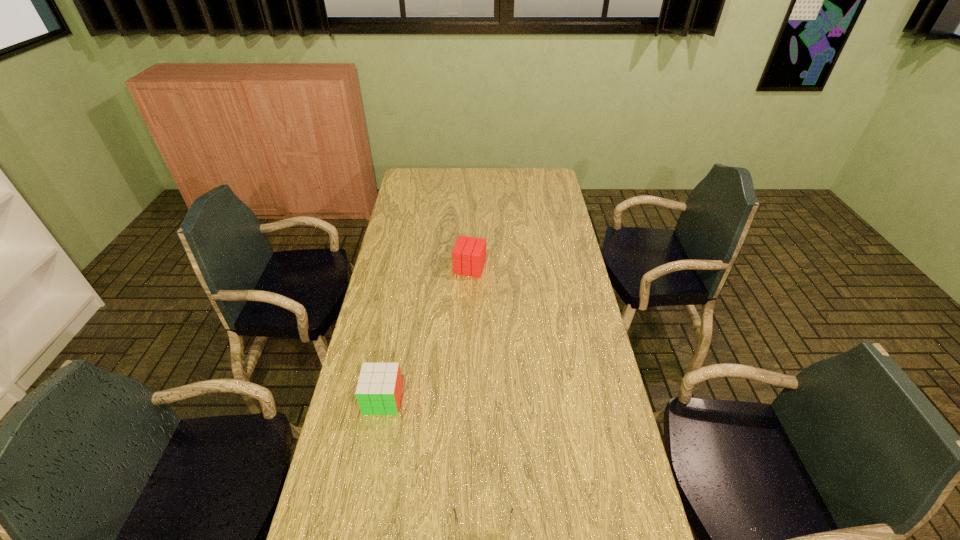
The image size is (960, 540). I want to click on free space at the far right corner, so click(x=528, y=179).

The height and width of the screenshot is (540, 960). Identify the location of free space that is in between the farther cube and the left cube. point(426,333).

Locate an element on the screen. The image size is (960, 540). vacant region between the leftmost object and the farther cube is located at coordinates (426, 333).

This screenshot has height=540, width=960. I want to click on empty space between the right cube and the leftmost object, so click(426, 333).

Where is `vacant space in between the farther cube and the leftmost object`? This screenshot has height=540, width=960. vacant space in between the farther cube and the leftmost object is located at coordinates (426, 333).

This screenshot has width=960, height=540. Find the location of `the second closest object to the nearest object`. the second closest object to the nearest object is located at coordinates (469, 253).

Identify which object is the nearest to the farther cube. Please provide its 2D coordinates. Your answer should be formatted as a tuple, i.e. [(x, y)], where the tuple contains the x and y coordinates of a point satisfying the conditions above.

[(379, 388)]